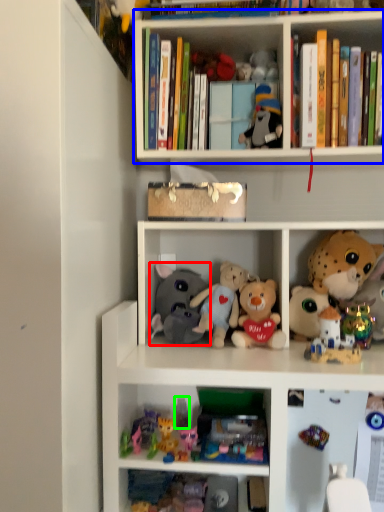
Question: Which object is the closest to the toy (highlighted by a red box)? Choose among these: shelf (highlighted by a blue box) or toy (highlighted by a green box).

Choices:
 (A) shelf
 (B) toy

Answer: (B)